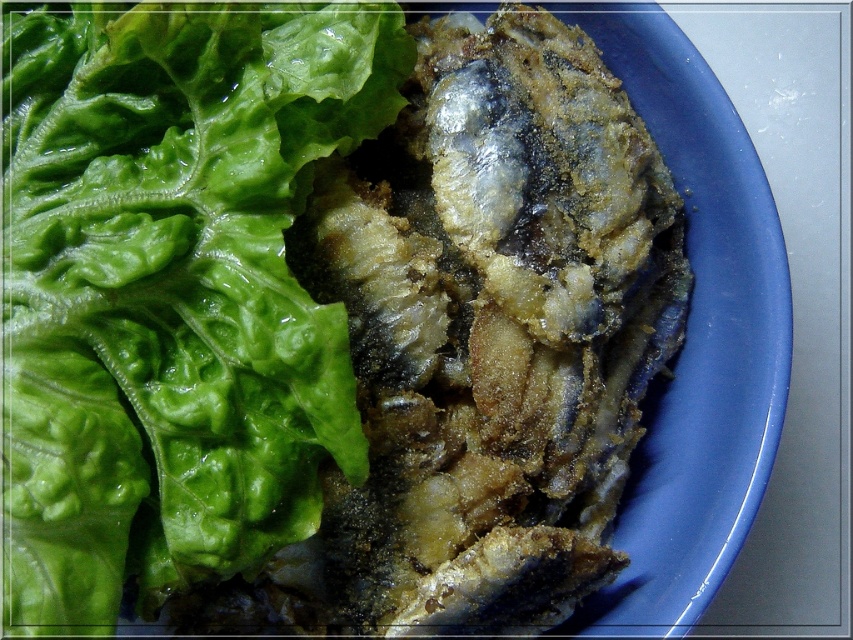
You are a food critic who needs to describe the position of the green leafy at upper left on the plate. What are its coordinates?

The green leafy at upper left is located at coordinates point (171, 289).